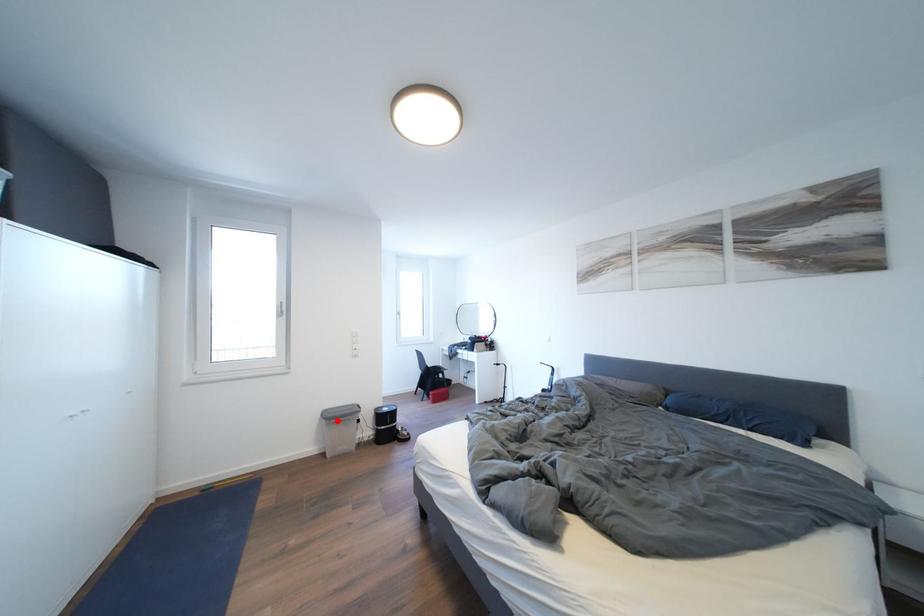
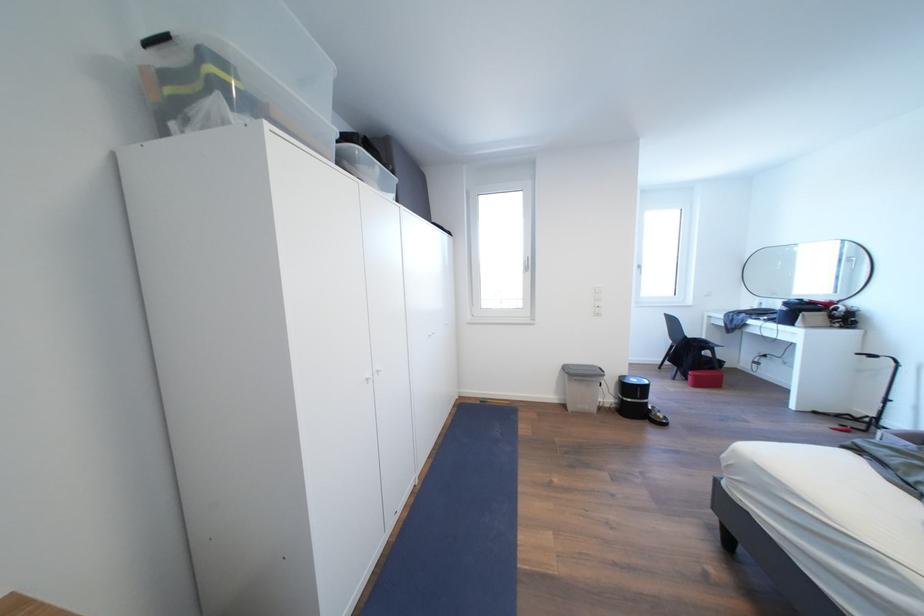
In the second image, find the point that corresponds to the highlighted location in the first image.

(579, 377)